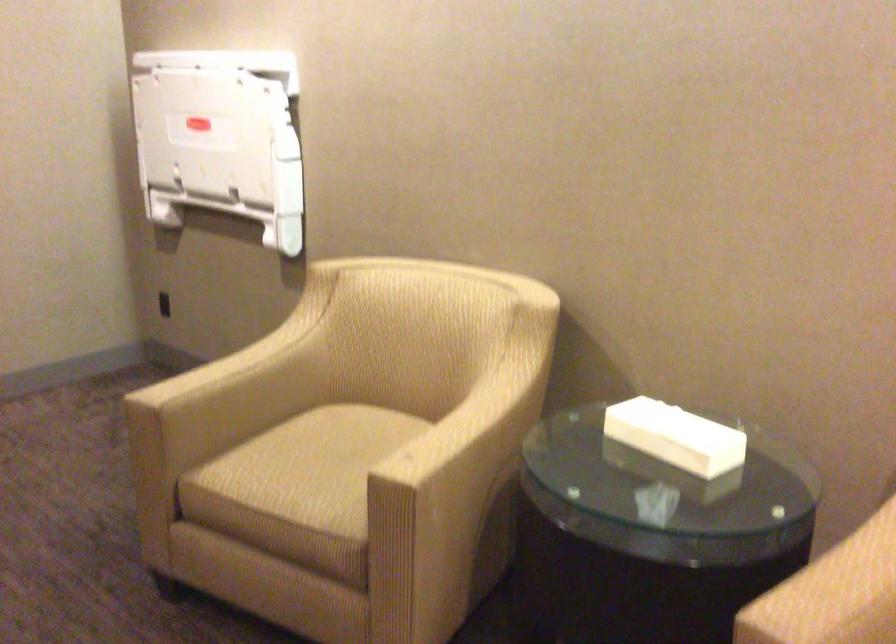
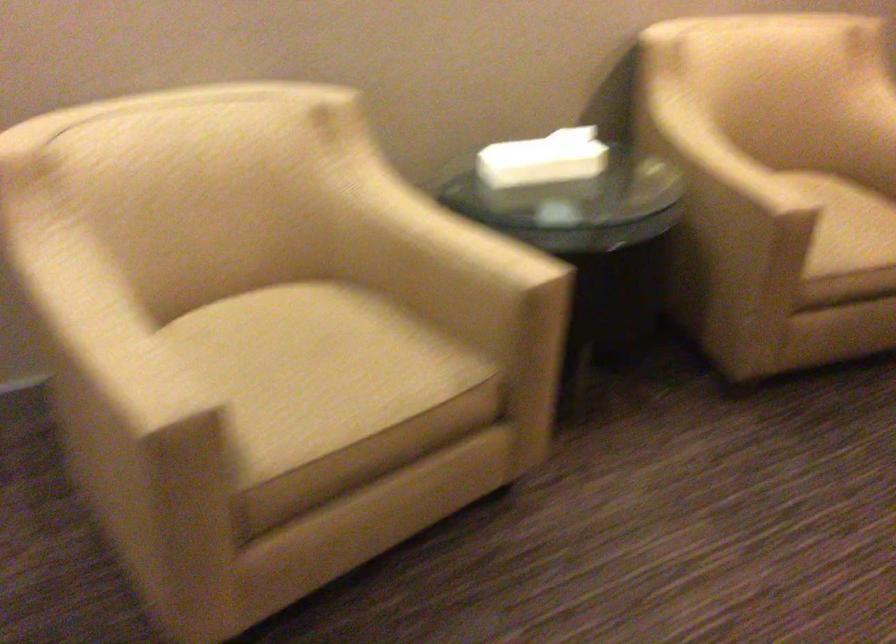
Find the pixel in the second image that matches [254,353] in the first image.

(89, 304)